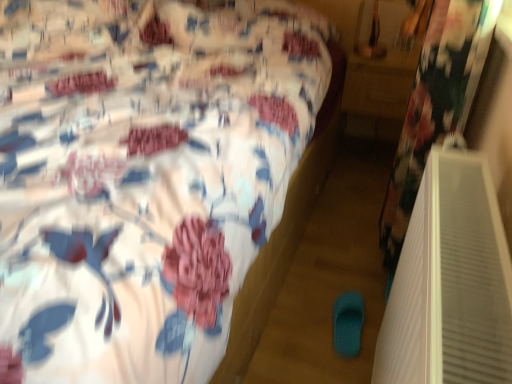
Question: Is teal rubber slipper at lower center positioned in front of wooden table at right?

Choices:
 (A) yes
 (B) no

Answer: (A)

Question: Considering the relative sizes of teal rubber slipper at lower center and wooden table at right in the image provided, is teal rubber slipper at lower center wider than wooden table at right?

Choices:
 (A) yes
 (B) no

Answer: (B)

Question: From the image's perspective, does teal rubber slipper at lower center appear higher than wooden table at right?

Choices:
 (A) no
 (B) yes

Answer: (A)

Question: Is teal rubber slipper at lower center thinner than wooden table at right?

Choices:
 (A) no
 (B) yes

Answer: (B)

Question: Is teal rubber slipper at lower center at the right side of wooden table at right?

Choices:
 (A) yes
 (B) no

Answer: (B)

Question: In terms of size, does teal rubber slipper at lower center appear bigger or smaller than floral fabric bed at center?

Choices:
 (A) big
 (B) small

Answer: (B)

Question: Considering the positions of teal rubber slipper at lower center and floral fabric bed at center in the image, is teal rubber slipper at lower center taller or shorter than floral fabric bed at center?

Choices:
 (A) short
 (B) tall

Answer: (A)

Question: In the image, is teal rubber slipper at lower center positioned in front of or behind floral fabric bed at center?

Choices:
 (A) front
 (B) behind

Answer: (B)

Question: Considering the positions of point coord(353,309) and point coord(273,170), is point coord(353,309) closer or farther from the camera than point coord(273,170)?

Choices:
 (A) farther
 (B) closer

Answer: (A)

Question: Looking at the image, does floral fabric bed at center seem bigger or smaller compared to wooden table at right?

Choices:
 (A) big
 (B) small

Answer: (A)

Question: From their relative heights in the image, would you say floral fabric bed at center is taller or shorter than wooden table at right?

Choices:
 (A) short
 (B) tall

Answer: (B)

Question: Considering their positions, is floral fabric bed at center located in front of or behind wooden table at right?

Choices:
 (A) front
 (B) behind

Answer: (A)

Question: From the image's perspective, is floral fabric bed at center positioned above or below wooden table at right?

Choices:
 (A) below
 (B) above

Answer: (A)

Question: Considering the positions of point (357, 352) and point (373, 132), is point (357, 352) closer or farther from the camera than point (373, 132)?

Choices:
 (A) farther
 (B) closer

Answer: (B)

Question: In the image, is teal rubber slipper at lower center on the left side or the right side of wooden table at right?

Choices:
 (A) left
 (B) right

Answer: (A)